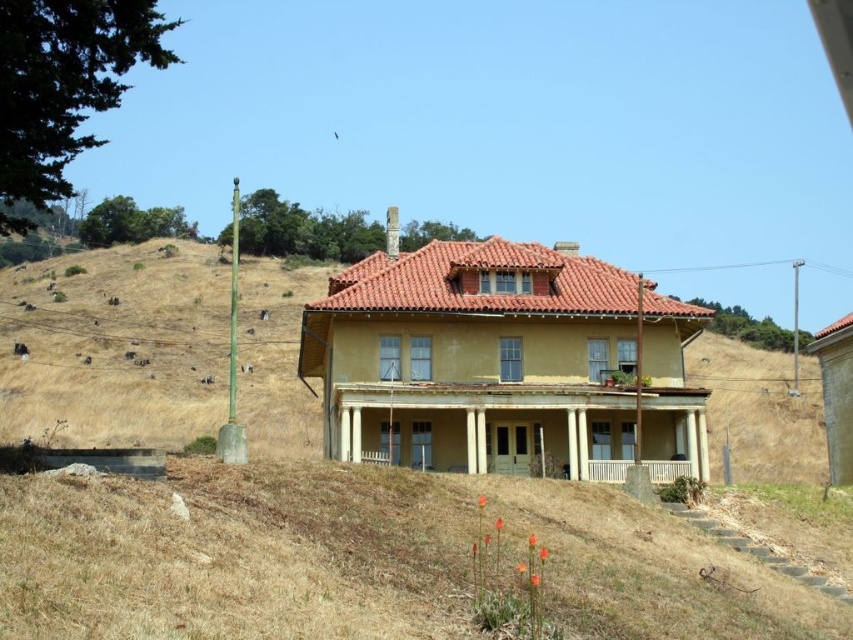
You are a landscape architect planning to install a new pathway between the dry grass at left and the yellow painted wood porch at center. Which area requires more space to accommodate the pathway?

The dry grass at left requires more space to accommodate the pathway because its width surpasses that of the yellow painted wood porch at center.

You are standing at the base of the hillside looking towards the house. There are two points marked on the image. The first point is at coordinates point (x=596, y=614) and the second point is at coordinates point (x=410, y=406). Which point is closer to you?

Point (x=596, y=614) is in front of point (x=410, y=406), so it is closer to you.